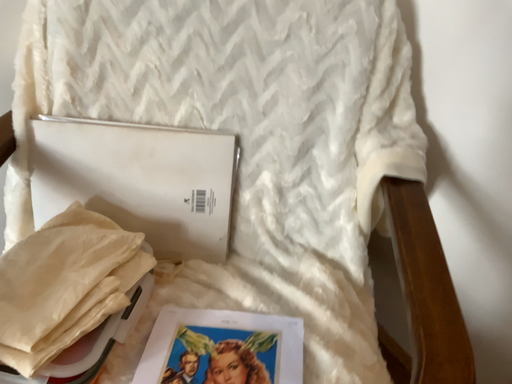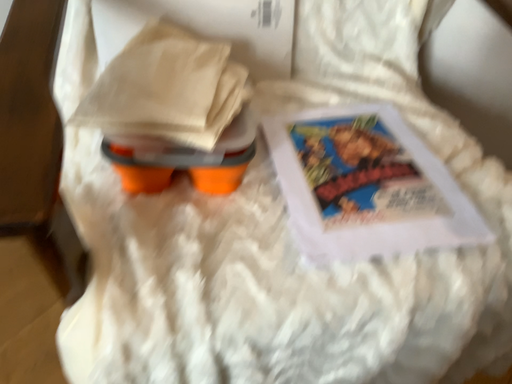
Question: Which way did the camera rotate in the video?

Choices:
 (A) rotated upward
 (B) rotated downward

Answer: (B)